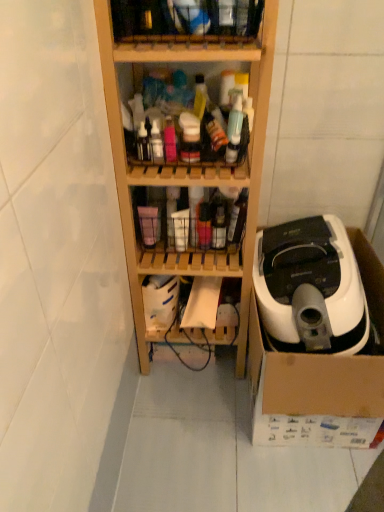
Question: Could you tell me if wooden shelf at upper center, positioned as the first shelf in top-to-bottom order, is turned towards white plastic vacuum cleaner at right?

Choices:
 (A) no
 (B) yes

Answer: (A)

Question: Can you confirm if wooden shelf at upper center, positioned as the first shelf in top-to-bottom order, is bigger than white plastic vacuum cleaner at right?

Choices:
 (A) no
 (B) yes

Answer: (A)

Question: From a real-world perspective, does wooden shelf at upper center, which is the fourth shelf in bottom-to-top order, stand above white plastic vacuum cleaner at right?

Choices:
 (A) no
 (B) yes

Answer: (B)

Question: From the image's perspective, is wooden shelf at upper center, positioned as the first shelf in top-to-bottom order, beneath white plastic vacuum cleaner at right?

Choices:
 (A) no
 (B) yes

Answer: (A)

Question: Is wooden shelf at upper center, positioned as the first shelf in top-to-bottom order, oriented away from white plastic vacuum cleaner at right?

Choices:
 (A) no
 (B) yes

Answer: (A)

Question: Relative to black rubber wire at lower center, is wooden shelf at upper center, which is the fourth shelf in bottom-to-top order, in front or behind?

Choices:
 (A) front
 (B) behind

Answer: (A)

Question: Is point (185, 35) positioned closer to the camera than point (208, 354)?

Choices:
 (A) closer
 (B) farther

Answer: (A)

Question: Considering the positions of wooden shelf at upper center, positioned as the first shelf in top-to-bottom order, and black rubber wire at lower center in the image, is wooden shelf at upper center, positioned as the first shelf in top-to-bottom order, bigger or smaller than black rubber wire at lower center?

Choices:
 (A) small
 (B) big

Answer: (B)

Question: From a real-world perspective, is wooden shelf at upper center, positioned as the first shelf in top-to-bottom order, positioned above or below black rubber wire at lower center?

Choices:
 (A) below
 (B) above

Answer: (B)

Question: Is black rubber wire at lower center taller or shorter than translucent plastic bottles at center, which is counted as the 3th shelf, starting from the bottom?

Choices:
 (A) tall
 (B) short

Answer: (A)

Question: Is black rubber wire at lower center situated inside translucent plastic bottles at center, which is counted as the 3th shelf, starting from the bottom, or outside?

Choices:
 (A) outside
 (B) inside

Answer: (A)

Question: Visually, is black rubber wire at lower center positioned to the left or to the right of translucent plastic bottles at center, which is counted as the 3th shelf, starting from the bottom?

Choices:
 (A) right
 (B) left

Answer: (B)

Question: Is black rubber wire at lower center bigger or smaller than translucent plastic bottles at center, placed as the second shelf when sorted from top to bottom?

Choices:
 (A) big
 (B) small

Answer: (B)

Question: From the image's perspective, is translucent plastic bottles at center, which is counted as the 1th shelf, starting from the bottom, located above or below white plastic vacuum cleaner at right?

Choices:
 (A) below
 (B) above

Answer: (B)

Question: Is point (167, 263) positioned closer to the camera than point (329, 287)?

Choices:
 (A) farther
 (B) closer

Answer: (A)